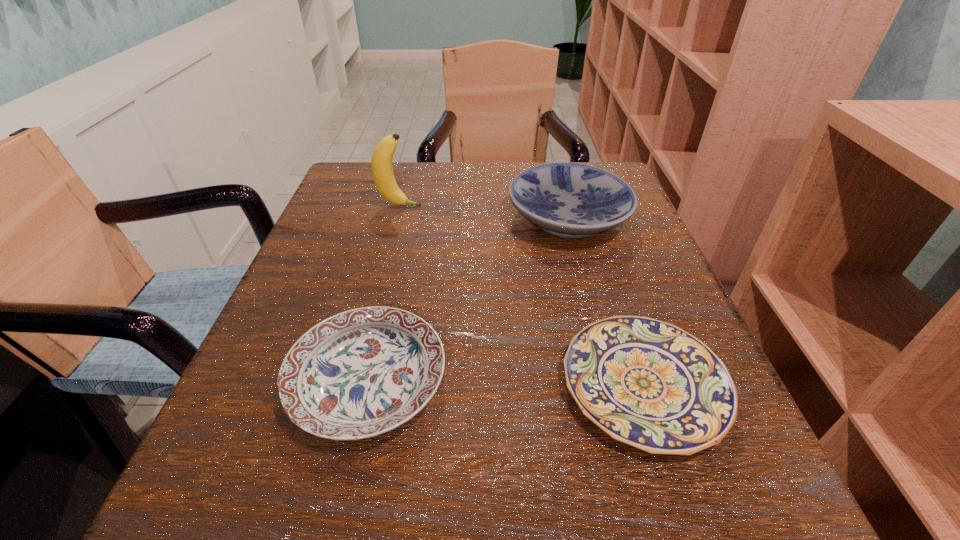
Locate an element on the screen. The image size is (960, 540). free location that satisfies the following two spatial constraints: 1. on the back side of the shortest plate; 2. from the stem of the tallest object is located at coordinates (584, 206).

Identify the location of free spot that satisfies the following two spatial constraints: 1. from the stem of the banana; 2. on the right side of the shortest object. The image size is (960, 540). (353, 386).

Locate an element on the screen. free spot that satisfies the following two spatial constraints: 1. from the stem of the tallest object; 2. on the right side of the tallest plate is located at coordinates (396, 218).

Identify the location of free spot that satisfies the following two spatial constraints: 1. on the back side of the shortest plate; 2. from the stem of the tallest object. This screenshot has height=540, width=960. (584, 206).

At what (x,y) coordinates should I click in order to perform the action: click on vacant space that satisfies the following two spatial constraints: 1. on the back side of the farthest plate; 2. on the right side of the third tallest object. Please return your answer as a coordinate pair (x, y). The width and height of the screenshot is (960, 540). Looking at the image, I should click on [x=405, y=218].

Find the location of a particular element. This screenshot has width=960, height=540. vacant space that satisfies the following two spatial constraints: 1. from the stem of the banana; 2. on the left side of the shortest plate is located at coordinates (353, 386).